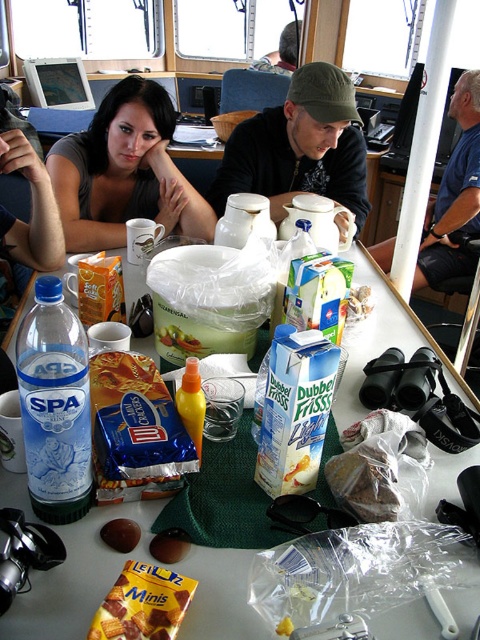
This screenshot has width=480, height=640. What do you see at coordinates (55, 404) in the screenshot? I see `matte plastic bottle at center-left` at bounding box center [55, 404].

Does matte plastic bottle at center-left appear on the left side of crumbly pastry at center?

Correct, you'll find matte plastic bottle at center-left to the left of crumbly pastry at center.

Is point (64, 376) more distant than point (351, 289)?

No, it is in front of (351, 289).

This screenshot has width=480, height=640. What are the coordinates of `matte plastic bottle at center-left` in the screenshot? It's located at (55, 404).

Is blue foil-wrapped chocolate at center positioned in front of crumbly pastry at center?

Yes, blue foil-wrapped chocolate at center is closer to the viewer.

Does blue foil-wrapped chocolate at center appear under crumbly pastry at center?

Yes, blue foil-wrapped chocolate at center is below crumbly pastry at center.

Does point (107, 451) come behind point (357, 298)?

No, it is not.

Locate an element on the screen. This screenshot has height=640, width=480. blue foil-wrapped chocolate at center is located at coordinates (134, 429).

Find the location of a particular element. This screenshot has height=640, width=480. matte gray shirt at upper left is located at coordinates (124, 172).

Is matte gray shirt at upper left wider than crumbly pastry at center?

Indeed, matte gray shirt at upper left has a greater width compared to crumbly pastry at center.

The height and width of the screenshot is (640, 480). I want to click on matte gray shirt at upper left, so click(x=124, y=172).

Where is `matte gray shirt at upper left`? This screenshot has height=640, width=480. matte gray shirt at upper left is located at coordinates (124, 172).